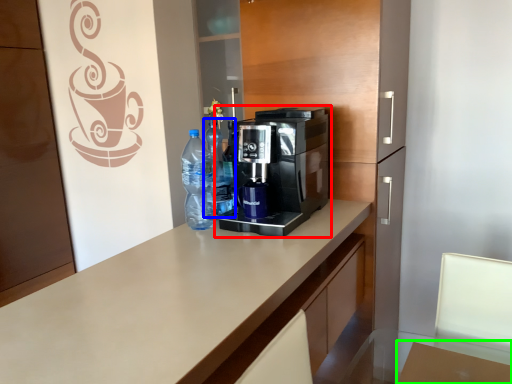
Question: Which object is positioned farthest from coffee maker (highlighted by a red box)? Select from bottle (highlighted by a blue box) and table (highlighted by a green box).

Choices:
 (A) bottle
 (B) table

Answer: (B)